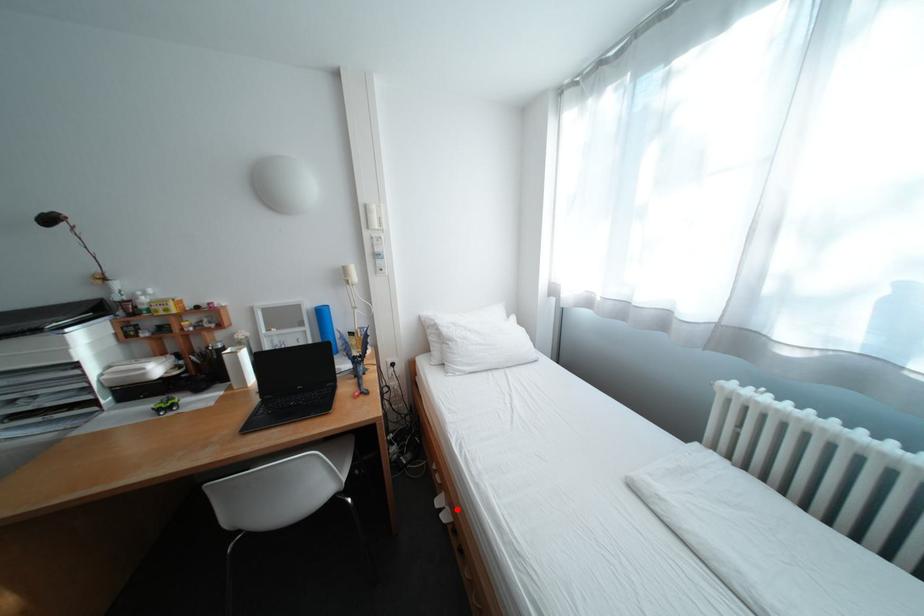
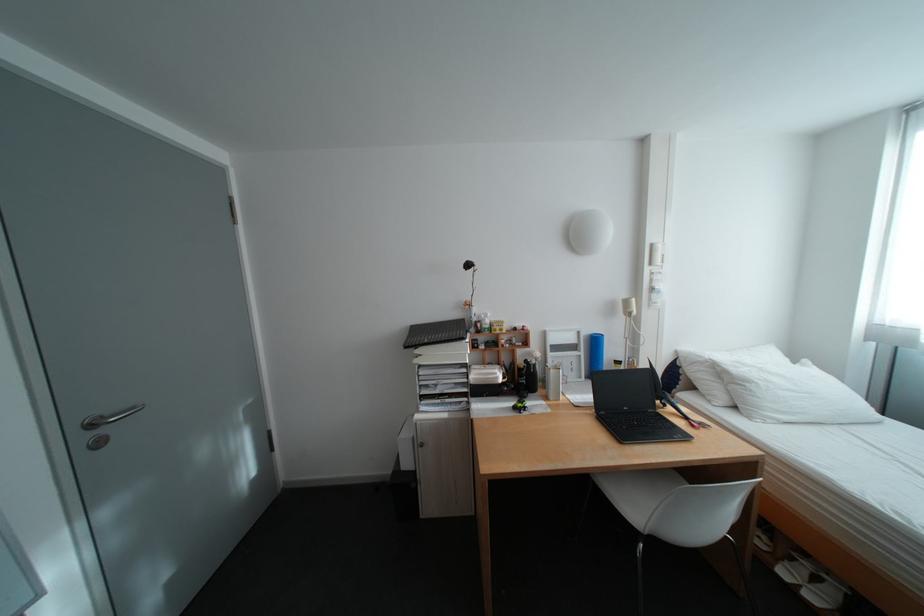
Where in the second image is the point corresponding to the highlighted location from the first image?

(813, 586)